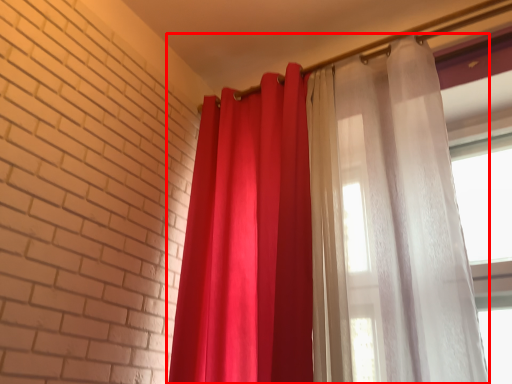
Question: From the image's perspective, what is the correct spatial relationship of curtain (annotated by the red box) in relation to curtain?

Choices:
 (A) below
 (B) above

Answer: (B)